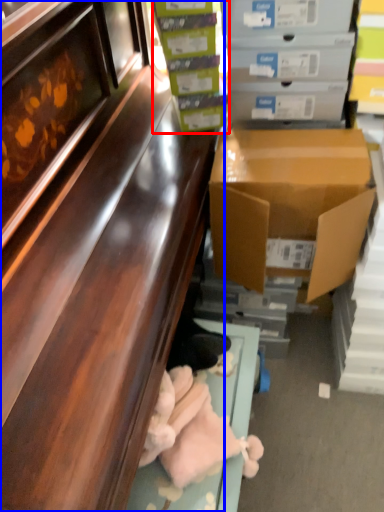
Question: Which object appears closest to the camera in this image, box (highlighted by a red box) or cabinetry (highlighted by a blue box)?

Choices:
 (A) box
 (B) cabinetry

Answer: (B)